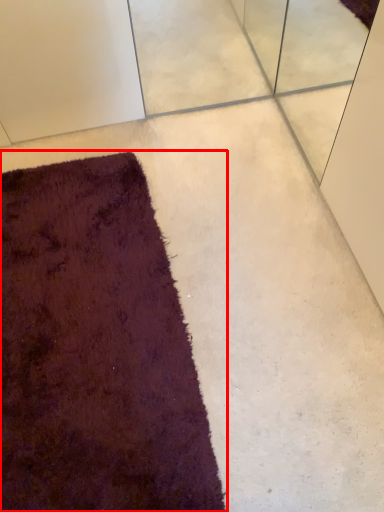
Question: From the image's perspective, considering the relative positions of towel (annotated by the red box) and concrete in the image provided, where is towel (annotated by the red box) located with respect to the staircase?

Choices:
 (A) below
 (B) above

Answer: (A)